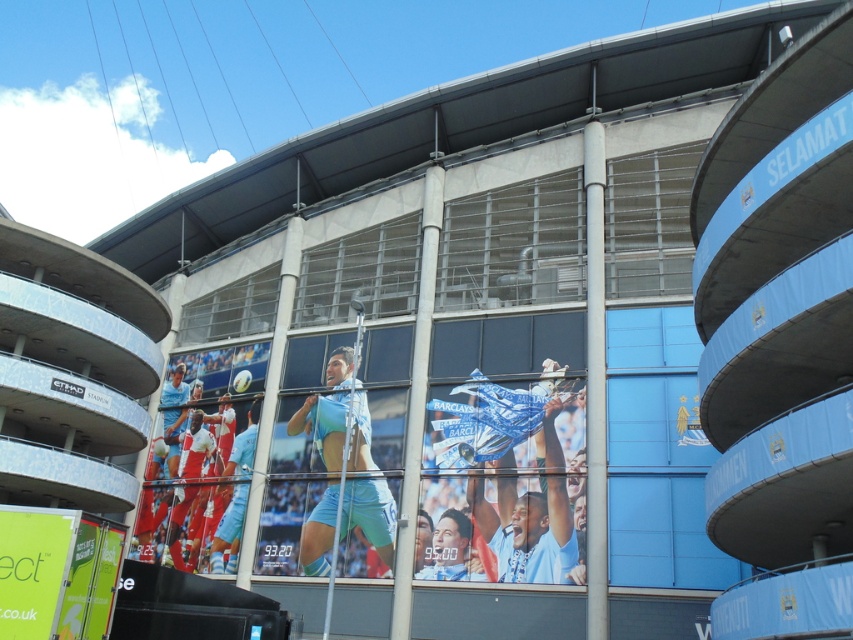
Is point (380, 545) positioned after point (532, 566)?

Yes, point (380, 545) is behind point (532, 566).

Measure the distance from light blue fabric at center to blue fabric banner at center.

light blue fabric at center is 9.94 meters from blue fabric banner at center.

Describe the element at coordinates (337, 417) in the screenshot. I see `light blue fabric at center` at that location.

The width and height of the screenshot is (853, 640). Find the location of `light blue fabric at center`. light blue fabric at center is located at coordinates (337, 417).

How much distance is there between light blue jersey at center and matte blue jersey at center?

light blue jersey at center is 17.23 meters away from matte blue jersey at center.

Based on the photo, between light blue jersey at center and matte blue jersey at center, which one appears on the right side from the viewer's perspective?

From the viewer's perspective, matte blue jersey at center appears more on the right side.

Where is `light blue jersey at center`? The width and height of the screenshot is (853, 640). light blue jersey at center is located at coordinates (235, 493).

Who is lower down, blue fabric banner at center or red fabric soccer player at center?

red fabric soccer player at center is lower down.

Between blue fabric banner at center and red fabric soccer player at center, which one is positioned higher?

blue fabric banner at center is above.

The width and height of the screenshot is (853, 640). Find the location of `blue fabric banner at center`. blue fabric banner at center is located at coordinates (527, 513).